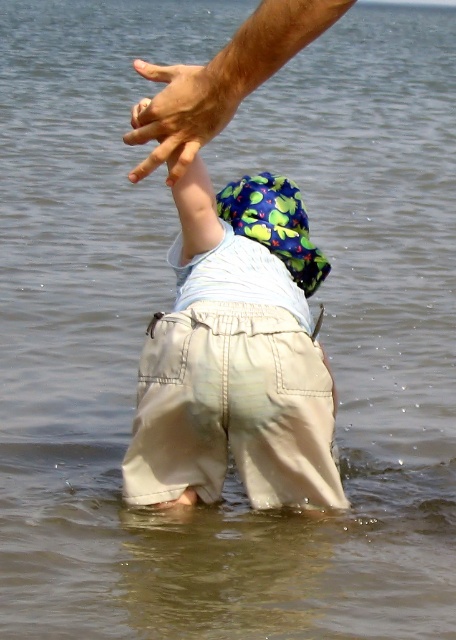
Question: Which of these objects is positioned closest to the smooth tan skin at upper center?

Choices:
 (A) khaki cotton shorts at center
 (B) smooth skin hand at upper center

Answer: (B)

Question: Is smooth tan skin at upper center positioned behind smooth skin hand at upper center?

Choices:
 (A) yes
 (B) no

Answer: (B)

Question: Observing the image, what is the correct spatial positioning of khaki cotton shorts at center in reference to smooth tan skin at upper center?

Choices:
 (A) left
 (B) right

Answer: (B)

Question: Which object is positioned closest to the smooth skin hand at upper center?

Choices:
 (A) khaki cotton shorts at center
 (B) smooth tan skin at upper center

Answer: (B)

Question: Does khaki cotton shorts at center lie behind smooth tan skin at upper center?

Choices:
 (A) yes
 (B) no

Answer: (A)

Question: Considering the real-world distances, which object is closest to the khaki cotton shorts at center?

Choices:
 (A) smooth skin hand at upper center
 (B) smooth tan skin at upper center

Answer: (A)